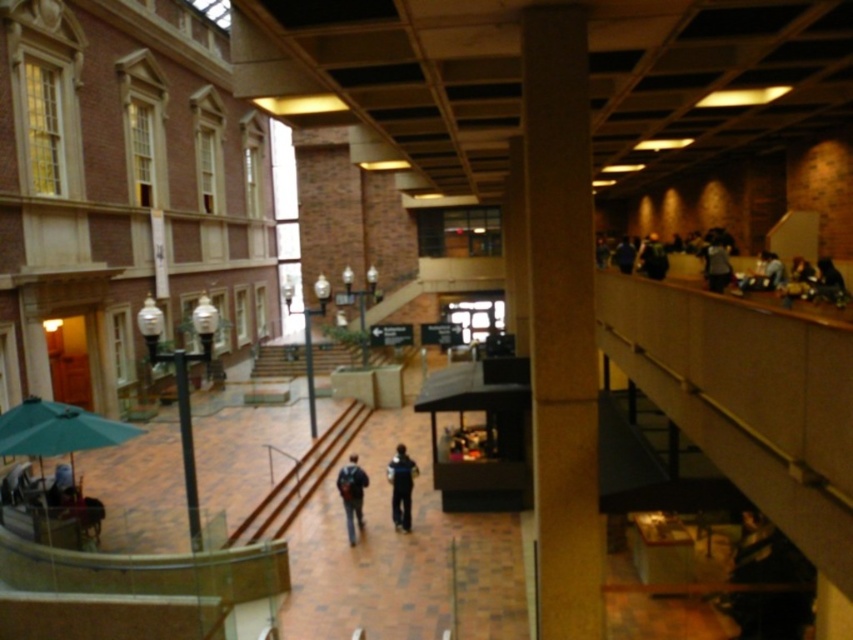
Question: Which of the following is the farthest from the observer?

Choices:
 (A) (577, 29)
 (B) (412, 468)

Answer: (B)

Question: Can you confirm if dark gray fabric jacket at right is positioned below dark blue jeans at center?

Choices:
 (A) yes
 (B) no

Answer: (B)

Question: Is green fabric umbrella at lower left smaller than dark blue backpack at center?

Choices:
 (A) no
 (B) yes

Answer: (A)

Question: Which point is farther to the camera?

Choices:
 (A) (587, 312)
 (B) (813, 266)

Answer: (B)

Question: Which point is farther to the camera?

Choices:
 (A) (347, 476)
 (B) (49, 406)

Answer: (A)

Question: Does brown textured pillar at center appear under dark blue backpack at center?

Choices:
 (A) no
 (B) yes

Answer: (A)